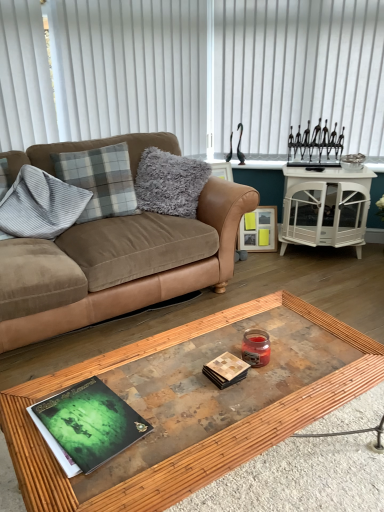
You are a GUI agent. You are given a task and a screenshot of the screen. Output one action in this format:
    pyautogui.click(x=<x>, y=<y>)
    Task: Click on the free space to the right of green matte book at center, the first magazine viewed from the left
    The height and width of the screenshot is (512, 384).
    Given the screenshot: What is the action you would take?
    pyautogui.click(x=188, y=433)